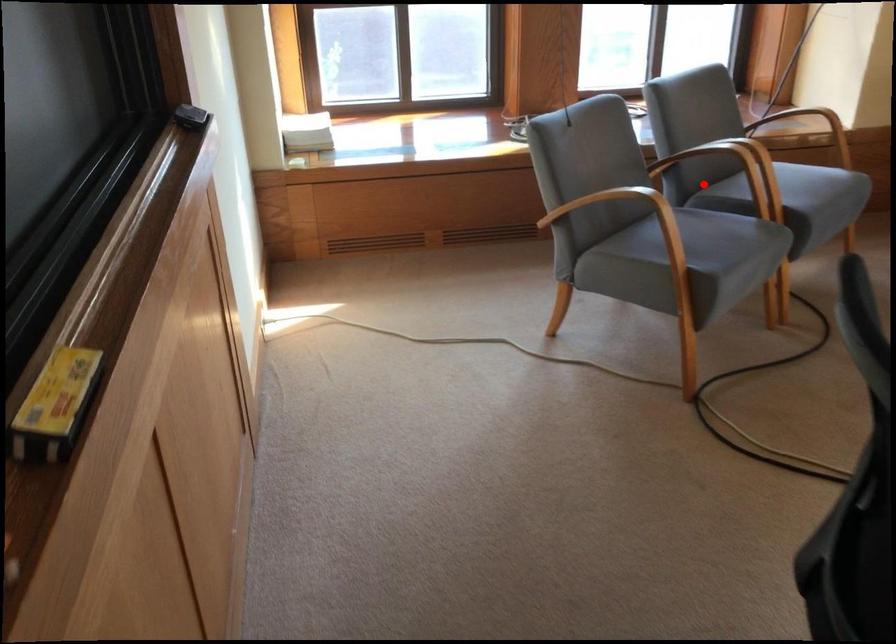
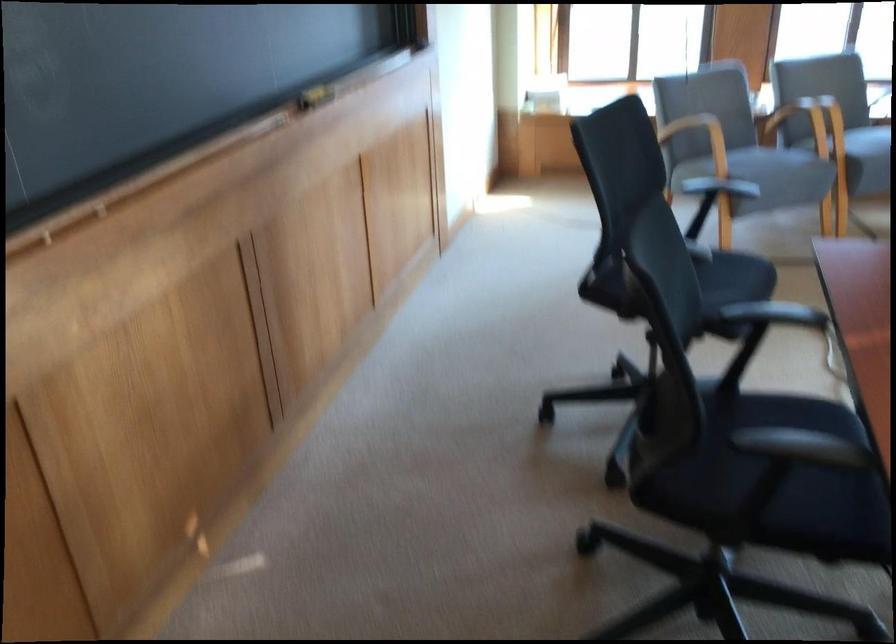
Where in the second image is the point corresponding to the highlighted location from the first image?

(799, 122)